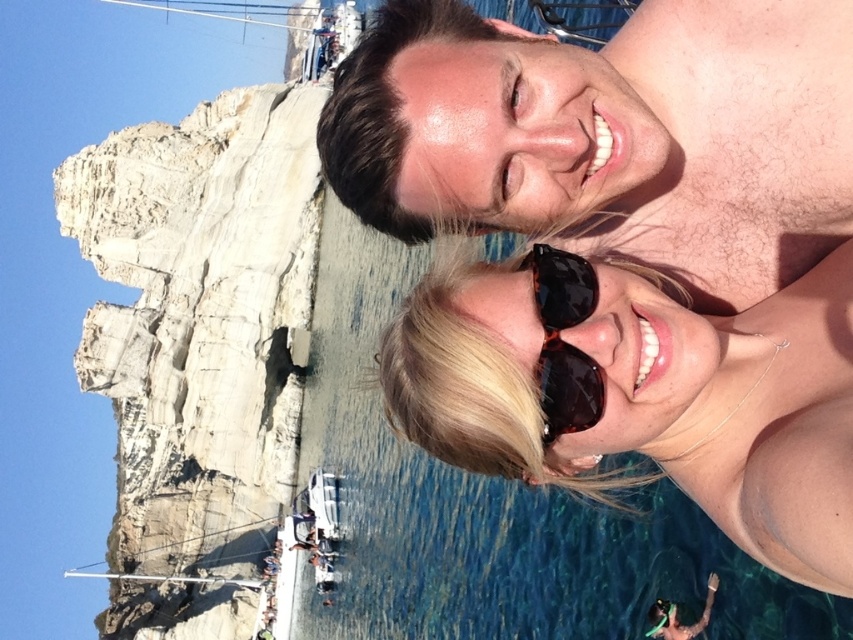
Can you confirm if brown shiny sunglasses at upper center is smaller than tortoiseshell sunglasses at center?

No.

Does brown shiny sunglasses at upper center have a lesser height compared to tortoiseshell sunglasses at center?

No.

Find the location of a particular element. brown shiny sunglasses at upper center is located at coordinates (642, 392).

Consider the image. Does white rocky cliff at left appear on the right side of tortoiseshell sunglasses at center?

Incorrect, white rocky cliff at left is not on the right side of tortoiseshell sunglasses at center.

Does white rocky cliff at left appear on the left side of tortoiseshell sunglasses at center?

Yes, white rocky cliff at left is to the left of tortoiseshell sunglasses at center.

The image size is (853, 640). I want to click on white rocky cliff at left, so click(199, 320).

Can you confirm if white rocky cliff at left is thinner than brown shiny sunglasses at upper center?

No.

Is white rocky cliff at left bigger than brown shiny sunglasses at upper center?

Correct, white rocky cliff at left is larger in size than brown shiny sunglasses at upper center.

You are a GUI agent. You are given a task and a screenshot of the screen. Output one action in this format:
    pyautogui.click(x=<x>, y=<y>)
    Task: Click on the white rocky cliff at left
    The width and height of the screenshot is (853, 640).
    Given the screenshot: What is the action you would take?
    pyautogui.click(x=199, y=320)

Where is `white rocky cliff at left`? Image resolution: width=853 pixels, height=640 pixels. white rocky cliff at left is located at coordinates (199, 320).